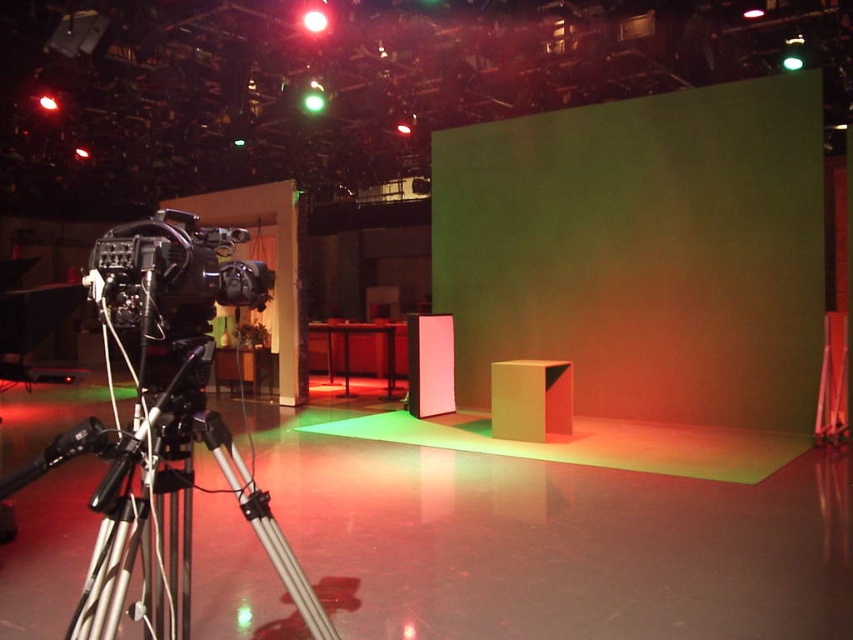
You are a camera operator in a studio. You need to position a new camera that is 1.2 meters wide between the green matte projection screen at center and the black matte camera at left. Is there enough space between them to place your new camera?

The distance between the green matte projection screen at center and the black matte camera at left is 5.31 meters. Since the new camera is only 1.2 meters wide, there is sufficient space to place it between them.

You are setting up a camera in the studio and need to adjust the height of the silver metallic tripod at left to match the height of the black matte camera at left. Is the tripod currently taller or shorter than the camera?

The silver metallic tripod at left is taller than the black matte camera at left, so you need to lower the tripod to match the camera height.